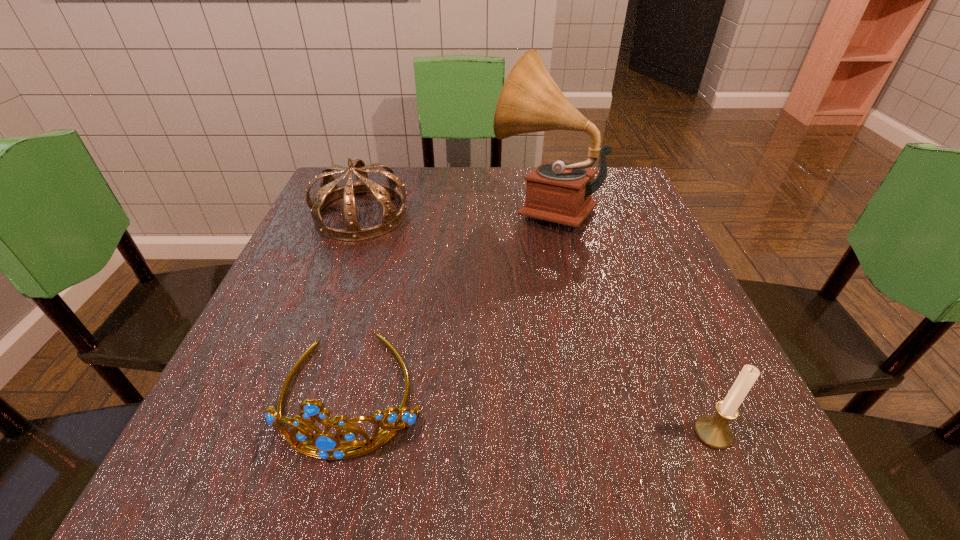
You are a GUI agent. You are given a task and a screenshot of the screen. Output one action in this format:
    pyautogui.click(x=<x>, y=<y>)
    Task: Click on the phonograph record that is at the far edge
    This screenshot has height=540, width=960.
    Given the screenshot: What is the action you would take?
    pyautogui.click(x=530, y=101)

You are a GUI agent. You are given a task and a screenshot of the screen. Output one action in this format:
    pyautogui.click(x=<x>, y=<y>)
    Task: Click on the tiara that is at the far edge
    
    Given the screenshot: What is the action you would take?
    [x=329, y=191]

Locate an element on the screen. candle holder located in the near edge section of the desktop is located at coordinates (713, 430).

Locate an element on the screen. Image resolution: width=960 pixels, height=540 pixels. tiara that is at the near edge is located at coordinates [x=328, y=446].

Where is `phonograph record that is at the right edge`? phonograph record that is at the right edge is located at coordinates (530, 101).

Locate an element on the screen. The image size is (960, 540). candle holder that is at the right edge is located at coordinates (713, 430).

The width and height of the screenshot is (960, 540). In order to click on object positioned at the far left corner in this screenshot , I will do `click(329, 191)`.

The image size is (960, 540). I want to click on object situated at the near left corner, so click(328, 446).

Locate an element on the screen. The width and height of the screenshot is (960, 540). object situated at the far right corner is located at coordinates (530, 101).

This screenshot has height=540, width=960. In order to click on object positioned at the near right corner in this screenshot , I will do `click(713, 430)`.